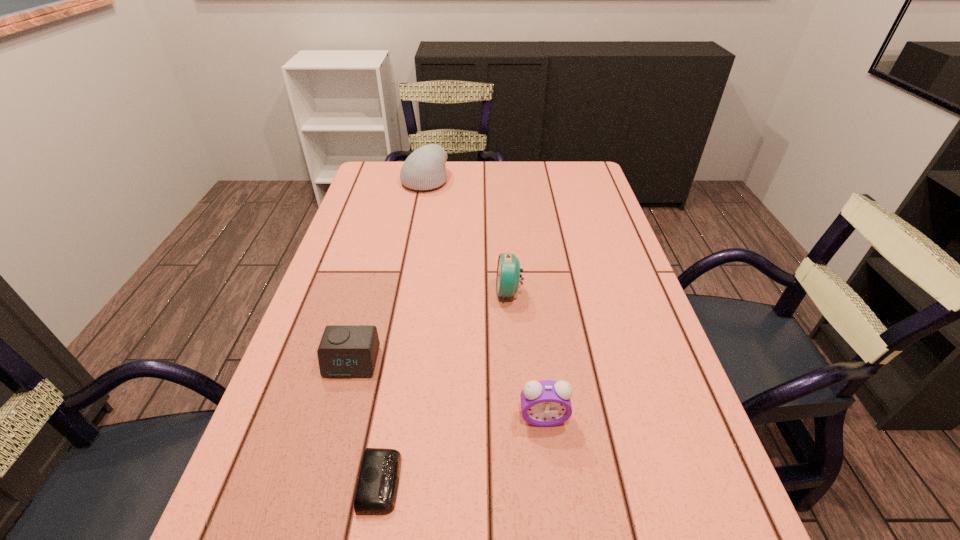
Where is `blank space located 0.300m on the front-facing side of the fourth nearest object`? blank space located 0.300m on the front-facing side of the fourth nearest object is located at coordinates (372, 292).

Locate an element on the screen. free space located 0.140m on the face of the third farthest alarm clock is located at coordinates (555, 509).

I want to click on vacant space located 0.140m on the front-facing side of the third tallest alarm clock, so click(329, 446).

The width and height of the screenshot is (960, 540). Find the location of `free region located on the display of the nearest object`. free region located on the display of the nearest object is located at coordinates (638, 482).

The width and height of the screenshot is (960, 540). Find the location of `object positioned at the far edge`. object positioned at the far edge is located at coordinates (424, 169).

At what (x,y) coordinates should I click in order to perform the action: click on beanie that is at the left edge. Please return your answer as a coordinate pair (x, y). Looking at the image, I should click on (424, 169).

Identify the location of alarm clock present at the left edge. The height and width of the screenshot is (540, 960). (345, 351).

This screenshot has height=540, width=960. I want to click on object located in the far left corner section of the desktop, so click(424, 169).

In order to click on blank space at the far edge of the desktop in this screenshot , I will do `click(467, 194)`.

Locate an element on the screen. This screenshot has height=540, width=960. vacant region at the left edge of the desktop is located at coordinates (255, 493).